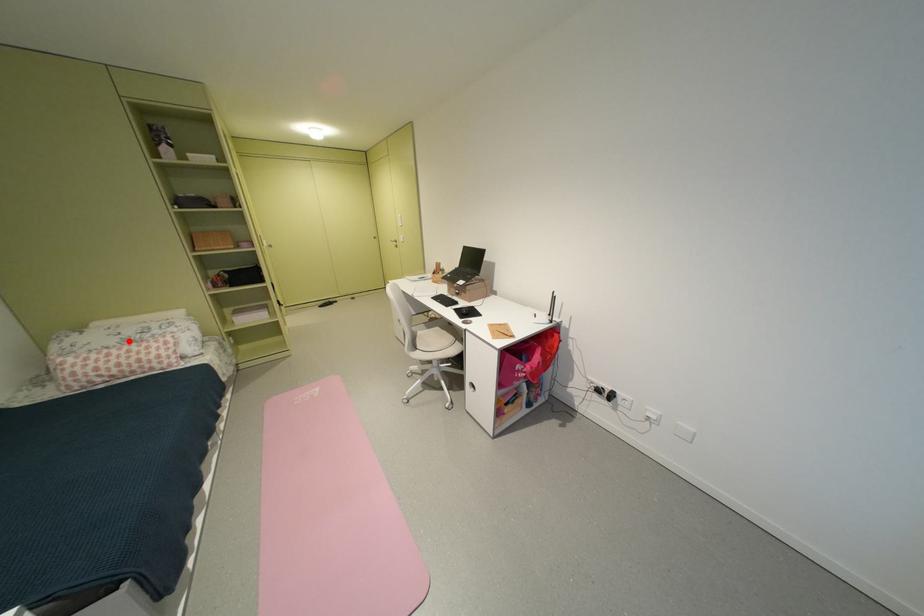
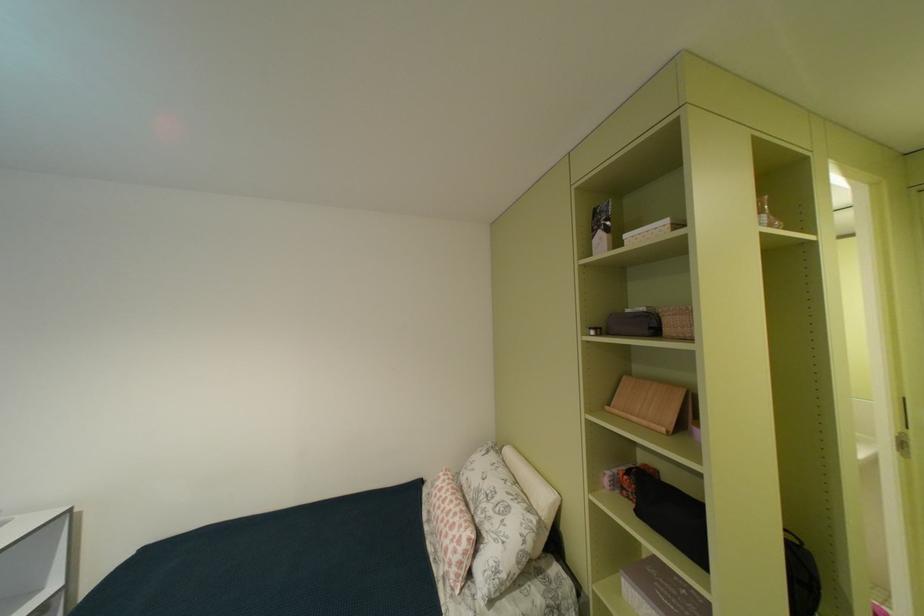
Where in the second image is the point corresponding to the highlighted location from the first image?

(487, 487)